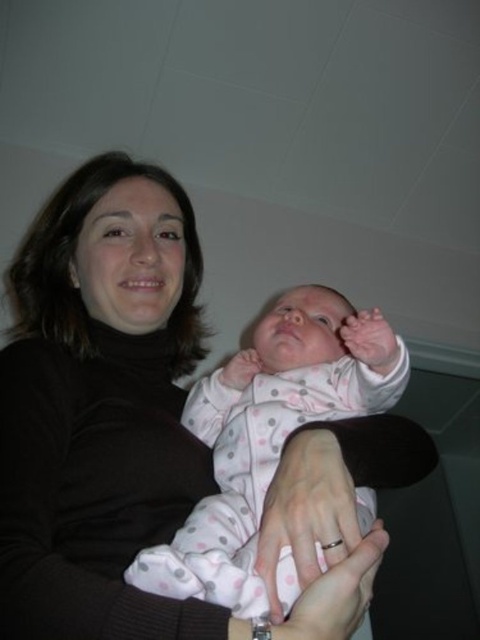
Measure the distance from matte black sweater at center to pink polka dot fabric at center.

matte black sweater at center and pink polka dot fabric at center are 5.73 inches apart from each other.

Can you confirm if matte black sweater at center is positioned below pink polka dot fabric at center?

No.

Which is in front, point (12, 390) or point (219, 410)?

Positioned in front is point (12, 390).

The image size is (480, 640). Identify the location of matte black sweater at center. (100, 410).